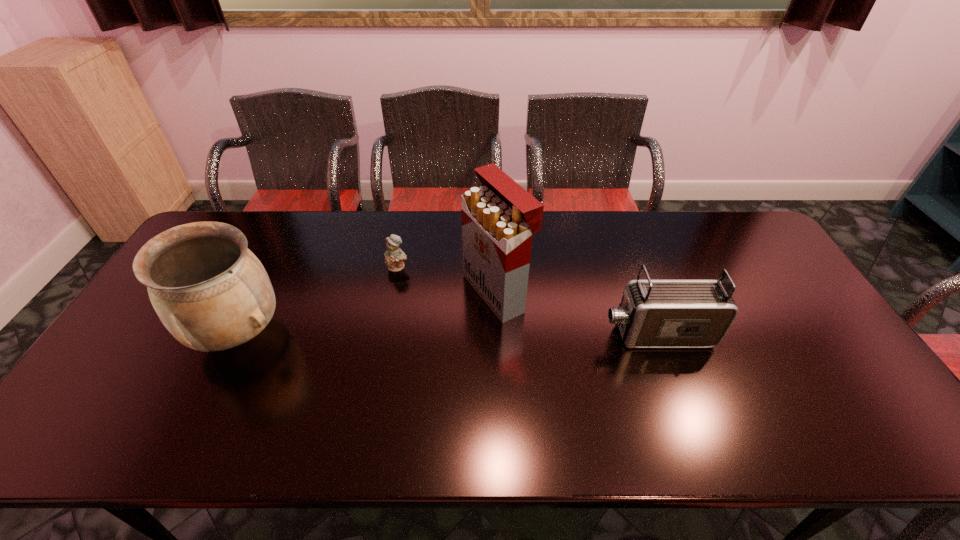
Find the location of `free space located at the lens of the third tallest object`. free space located at the lens of the third tallest object is located at coordinates coord(579,334).

Find the location of a particular element. Image resolution: width=960 pixels, height=540 pixels. vacant space located at the lens of the third tallest object is located at coordinates (514, 334).

Find the location of `vacant space located on the front-facing side of the shortest object`. vacant space located on the front-facing side of the shortest object is located at coordinates (396, 303).

Image resolution: width=960 pixels, height=540 pixels. In order to click on blank area located 0.180m on the front-facing side of the shortest object in this screenshot , I will do `click(395, 316)`.

Find the location of a particular element. vacant space located 0.150m on the front-facing side of the shortest object is located at coordinates (395, 309).

Identify the location of vacant region located with the lid open on the tallest object. (410, 332).

Image resolution: width=960 pixels, height=540 pixels. Find the location of `free point located 0.390m with the lid open on the tallest object`. free point located 0.390m with the lid open on the tallest object is located at coordinates (335, 364).

The width and height of the screenshot is (960, 540). What are the coordinates of `vacant space located 0.060m with the lid open on the tallest object` in the screenshot? It's located at (448, 315).

Where is `object that is at the left edge`? This screenshot has width=960, height=540. object that is at the left edge is located at coordinates (209, 290).

What are the coordinates of `free space at the far edge` in the screenshot? It's located at click(x=684, y=254).